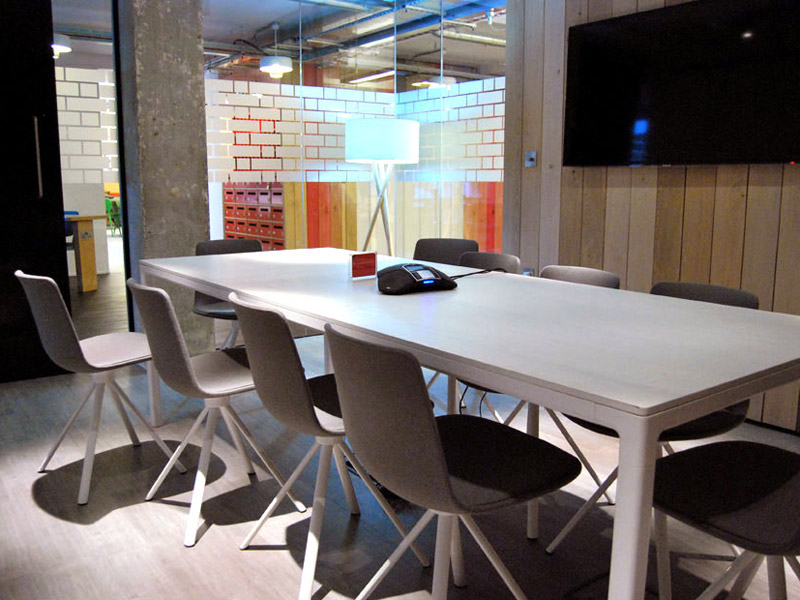
Where is `floor under the table`? Image resolution: width=800 pixels, height=600 pixels. floor under the table is located at coordinates pyautogui.click(x=526, y=541).